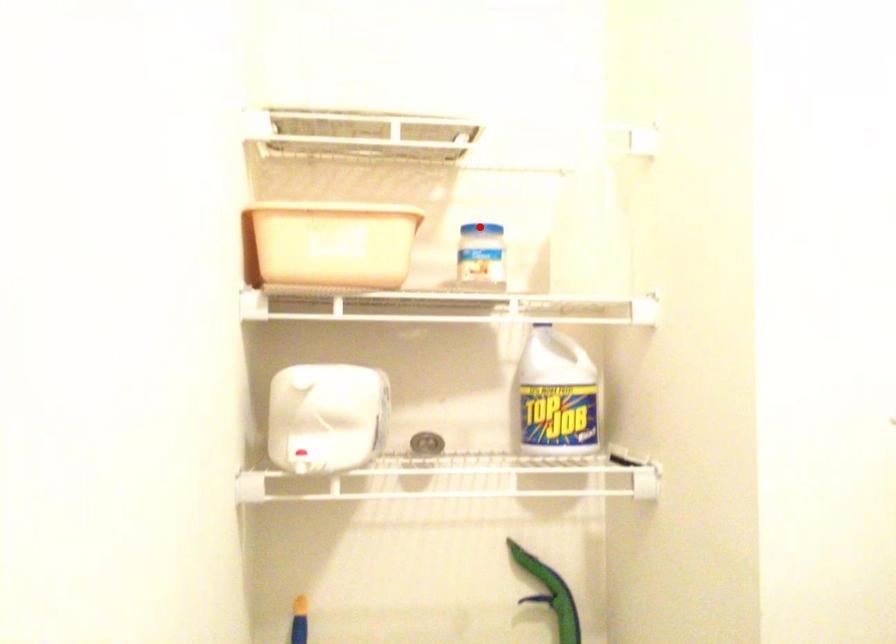
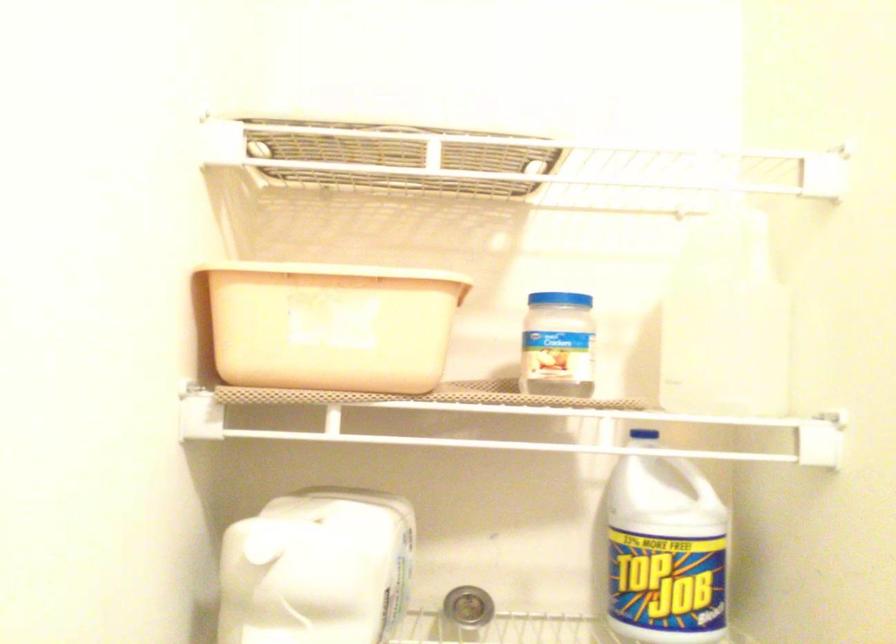
Question: A red point is marked in image1. In image2, is the corresponding 3D point closer to the camera or farther? Reply with the corresponding letter.

Choices:
 (A) The corresponding 3D point is closer.
 (B) The corresponding 3D point is farther.

Answer: (A)